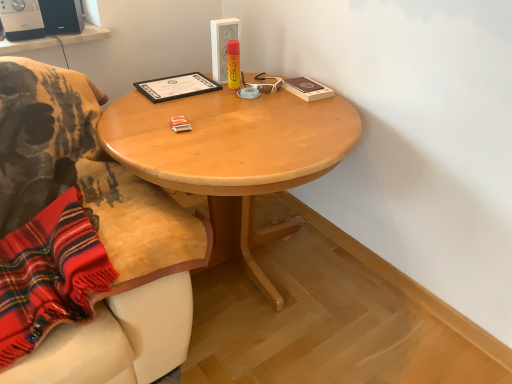
Question: From a real-world perspective, is black matte certificate at upper center located beneath light wood table at center?

Choices:
 (A) no
 (B) yes

Answer: (A)

Question: Is black matte certificate at upper center at the right side of light wood table at center?

Choices:
 (A) no
 (B) yes

Answer: (A)

Question: Could you tell me if black matte certificate at upper center is facing light wood table at center?

Choices:
 (A) no
 (B) yes

Answer: (B)

Question: Is black matte certificate at upper center not within light wood table at center?

Choices:
 (A) no
 (B) yes

Answer: (A)

Question: Is black matte certificate at upper center wider than light wood table at center?

Choices:
 (A) no
 (B) yes

Answer: (A)

Question: From the image's perspective, is black matte certificate at upper center located above or below matte black speaker at upper left, the 2th loudspeaker viewed from the left?

Choices:
 (A) below
 (B) above

Answer: (A)

Question: From a real-world perspective, is black matte certificate at upper center above or below matte black speaker at upper left, the 2th loudspeaker viewed from the left?

Choices:
 (A) below
 (B) above

Answer: (A)

Question: Do you think black matte certificate at upper center is within matte black speaker at upper left, the 1th loudspeaker from the right, or outside of it?

Choices:
 (A) outside
 (B) inside

Answer: (A)

Question: From their relative heights in the image, would you say black matte certificate at upper center is taller or shorter than matte black speaker at upper left, the 2th loudspeaker viewed from the left?

Choices:
 (A) tall
 (B) short

Answer: (B)

Question: From their relative heights in the image, would you say matte black speaker at upper left, the 1th loudspeaker from the right, is taller or shorter than black matte certificate at upper center?

Choices:
 (A) short
 (B) tall

Answer: (B)

Question: Would you say matte black speaker at upper left, the 2th loudspeaker viewed from the left, is inside or outside black matte certificate at upper center?

Choices:
 (A) inside
 (B) outside

Answer: (B)

Question: From the image's perspective, is matte black speaker at upper left, the 2th loudspeaker viewed from the left, located above or below black matte certificate at upper center?

Choices:
 (A) above
 (B) below

Answer: (A)

Question: Looking at their shapes, would you say matte black speaker at upper left, the 1th loudspeaker from the right, is wider or thinner than black matte certificate at upper center?

Choices:
 (A) thin
 (B) wide

Answer: (A)

Question: From a real-world perspective, is black plastic speaker at upper left, which is counted as the second loudspeaker, starting from the right, physically located above or below black matte certificate at upper center?

Choices:
 (A) below
 (B) above

Answer: (B)

Question: From the image's perspective, relative to black matte certificate at upper center, is black plastic speaker at upper left, the 1th loudspeaker from the left, above or below?

Choices:
 (A) below
 (B) above

Answer: (B)